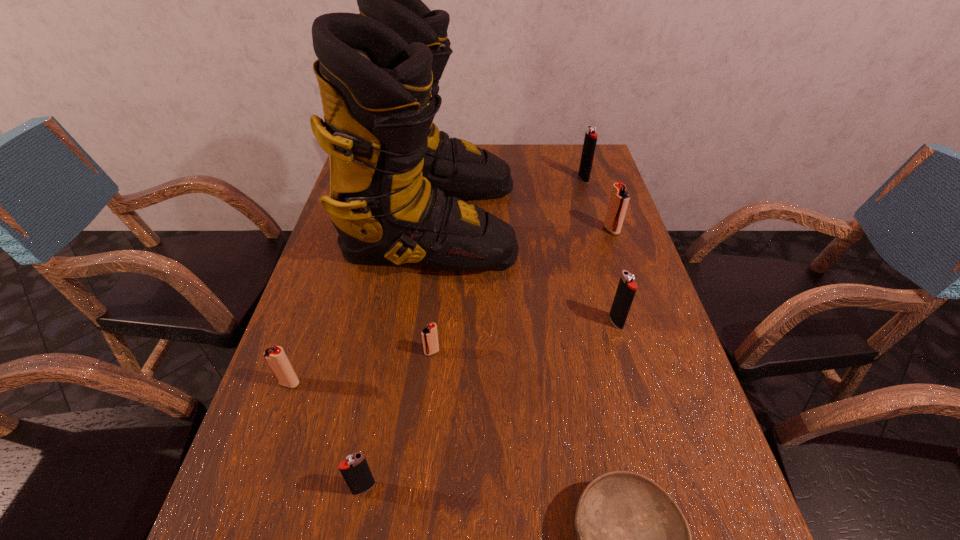
Where is `ski boots present at the far edge`? This screenshot has width=960, height=540. ski boots present at the far edge is located at coordinates (397, 184).

At what (x,y) coordinates should I click in order to perform the action: click on igniter that is at the far edge. Please return your answer as a coordinate pair (x, y). The width and height of the screenshot is (960, 540). Looking at the image, I should click on (590, 140).

Locate an element on the screen. ski boots present at the left edge is located at coordinates (397, 184).

I want to click on igniter that is positioned at the left edge, so click(275, 356).

Locate an element on the screen. The height and width of the screenshot is (540, 960). object present at the far left corner is located at coordinates pos(397,184).

Where is `object positioned at the far right corner`? object positioned at the far right corner is located at coordinates (590, 140).

Locate an element on the screen. The height and width of the screenshot is (540, 960). free space at the left edge is located at coordinates (304, 342).

At what (x,y) coordinates should I click in order to perform the action: click on vacant space at the right edge of the desktop. Please return your answer as a coordinate pair (x, y). Looking at the image, I should click on (590, 207).

Identify the location of free point between the fourth nearest igniter and the farthest igniter. (600, 250).

Locate an element on the screen. This screenshot has height=540, width=960. blank region between the second smallest red igniter and the farthest igniter is located at coordinates (437, 281).